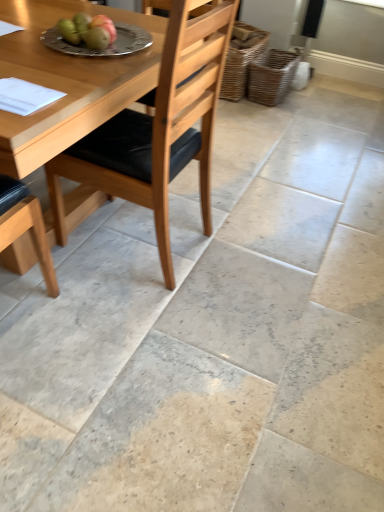
Question: Does point (86, 41) appear closer or farther from the camera than point (114, 49)?

Choices:
 (A) closer
 (B) farther

Answer: (A)

Question: Is green matte pear at upper left, which appears as the 2th fruit when viewed from the left, wider or thinner than silver metallic plate at upper center?

Choices:
 (A) thin
 (B) wide

Answer: (A)

Question: Which object is positioned closest to the green matte pear at upper left, which is the first fruit in right-to-left order?

Choices:
 (A) green matte apple at upper left, which ranks as the first fruit in left-to-right order
 (B) woven brown basket at center, which is the 2th basket from right to left
 (C) silver metallic plate at upper center
 (D) natural wood chair at center
 (E) woven brown basket at lower right, arranged as the first basket when viewed from the right

Answer: (A)

Question: Which of these objects is positioned closest to the white paper at upper left?

Choices:
 (A) green matte apple at upper left, which ranks as the first fruit in left-to-right order
 (B) woven brown basket at lower right, arranged as the first basket when viewed from the right
 (C) woven brown basket at center, the 1th basket viewed from the left
 (D) silver metallic plate at upper center
 (E) green matte pear at upper left, which appears as the 2th fruit when viewed from the left

Answer: (D)